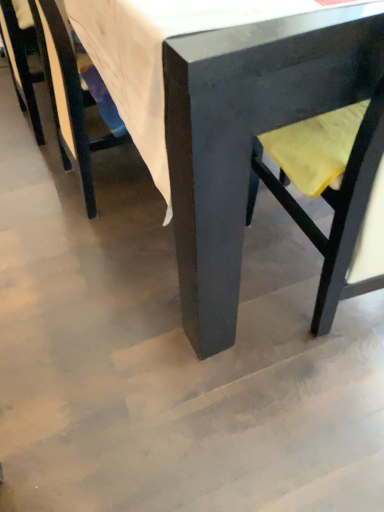
Question: Is matte black chair at center, which is counted as the 3th chair, starting from the left, turned away from matte black chair at left, positioned as the first chair in left-to-right order?

Choices:
 (A) no
 (B) yes

Answer: (A)

Question: Does matte black chair at center, which is counted as the 3th chair, starting from the left, have a smaller size compared to matte black chair at left, the 3th chair when ordered from right to left?

Choices:
 (A) yes
 (B) no

Answer: (B)

Question: Does matte black chair at center, the 1th chair positioned from the right, appear on the left side of matte black chair at left, the 3th chair when ordered from right to left?

Choices:
 (A) yes
 (B) no

Answer: (B)

Question: Does matte black chair at center, which is counted as the 3th chair, starting from the left, have a larger size compared to matte black chair at left, positioned as the first chair in left-to-right order?

Choices:
 (A) no
 (B) yes

Answer: (B)

Question: From the image's perspective, is matte black chair at center, the 1th chair positioned from the right, located above matte black chair at left, the 3th chair when ordered from right to left?

Choices:
 (A) no
 (B) yes

Answer: (B)

Question: Could you tell me if matte black chair at center, the 1th chair positioned from the right, is facing matte black chair at left, positioned as the first chair in left-to-right order?

Choices:
 (A) yes
 (B) no

Answer: (A)

Question: From a real-world perspective, is matte black chair at left, positioned as the first chair in left-to-right order, under matte black chair at center, the 1th chair positioned from the right?

Choices:
 (A) yes
 (B) no

Answer: (A)

Question: Can you confirm if matte black chair at left, the 3th chair when ordered from right to left, is positioned to the right of matte black chair at center, which is counted as the 3th chair, starting from the left?

Choices:
 (A) no
 (B) yes

Answer: (A)

Question: Can you confirm if matte black chair at left, the 3th chair when ordered from right to left, is positioned to the left of matte black chair at center, which is counted as the 3th chair, starting from the left?

Choices:
 (A) yes
 (B) no

Answer: (A)

Question: Does matte black chair at left, the 3th chair when ordered from right to left, have a smaller size compared to matte black chair at center, the 1th chair positioned from the right?

Choices:
 (A) yes
 (B) no

Answer: (A)

Question: Is matte black chair at left, the 3th chair when ordered from right to left, wider than matte black chair at center, which is counted as the 3th chair, starting from the left?

Choices:
 (A) yes
 (B) no

Answer: (B)

Question: Is the surface of matte black chair at left, positioned as the first chair in left-to-right order, in direct contact with matte black chair at center, the 1th chair positioned from the right?

Choices:
 (A) no
 (B) yes

Answer: (A)

Question: Is yellow fabric swivel chair at right positioned beyond the bounds of matte black chair at center, which is counted as the 3th chair, starting from the left?

Choices:
 (A) yes
 (B) no

Answer: (B)